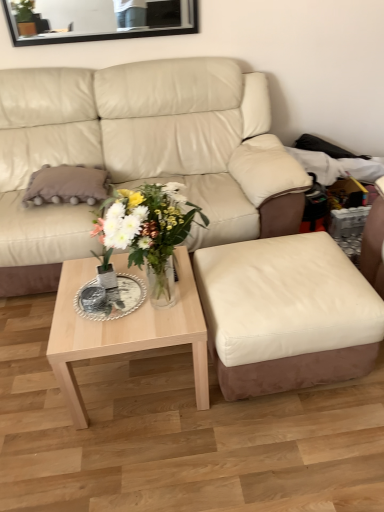
I want to click on vacant area in front of light wood/texture coffee table at center, so click(x=147, y=459).